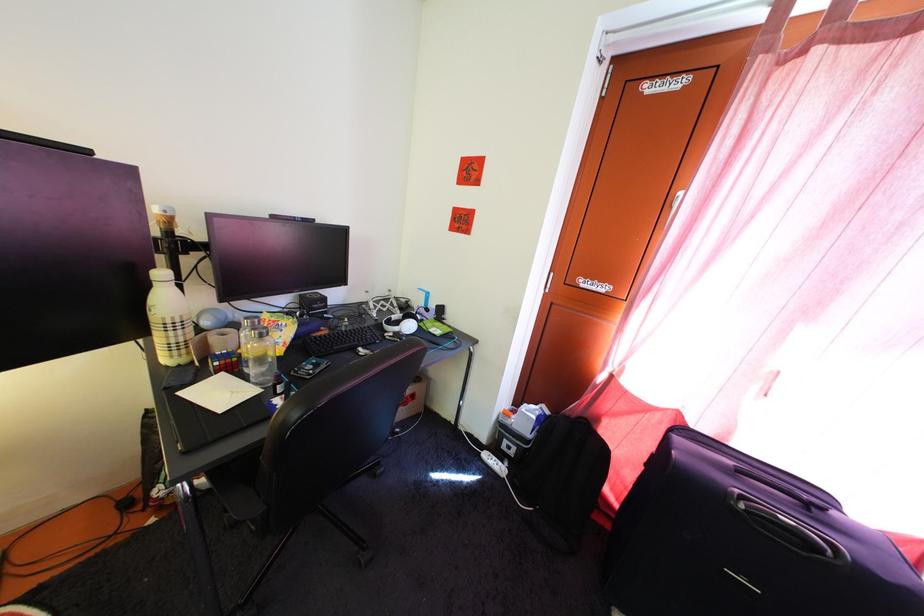
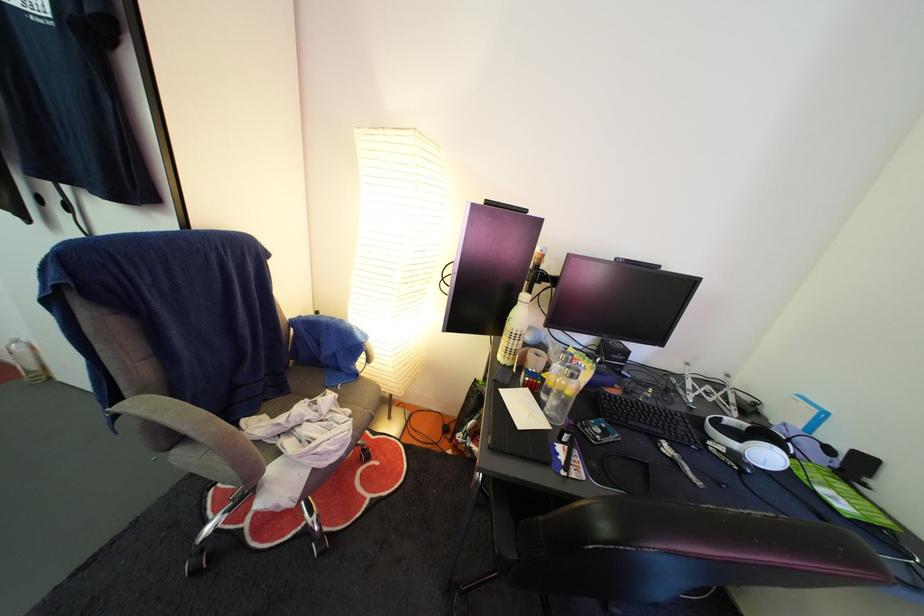
Question: Based on the continuous images, in which direction is the camera rotating? Reply with the corresponding letter.

Choices:
 (A) Left
 (B) Right
 (C) Up
 (D) Down

Answer: (A)